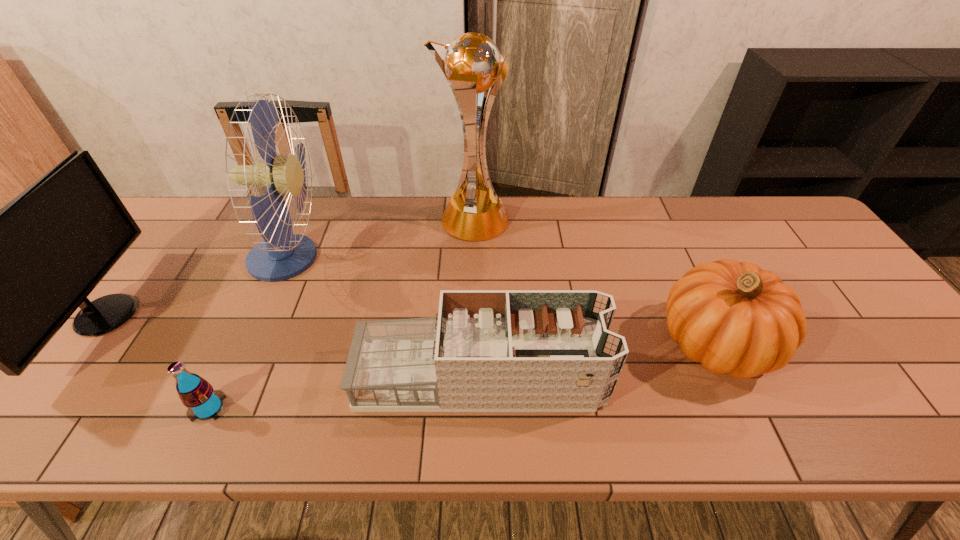
Locate which object is the third closest to the leftmost object. Please provide its 2D coordinates. Your answer should be formatted as a tuple, i.e. [(x, y)], where the tuple contains the x and y coordinates of a point satisfying the conditions above.

[(486, 350)]

Locate an element on the screen. The width and height of the screenshot is (960, 540). free space that satisfies the following two spatial constraints: 1. on the front-facing side of the leftmost object; 2. on the right side of the pumpkin is located at coordinates (85, 343).

Identify the location of blank area in the image that satisfies the following two spatial constraints: 1. at the front of the second tallest object where the blades are visible; 2. on the back side of the fourth tallest object. This screenshot has width=960, height=540. (250, 343).

Locate an element on the screen. vacant area that satisfies the following two spatial constraints: 1. on the front-facing side of the shortest object; 2. on the left side of the third tallest object is located at coordinates (35, 408).

Where is `vacant position in the image that satisfies the following two spatial constraints: 1. on the back side of the shortest object; 2. on the front-facing side of the leftmost object`? The height and width of the screenshot is (540, 960). vacant position in the image that satisfies the following two spatial constraints: 1. on the back side of the shortest object; 2. on the front-facing side of the leftmost object is located at coordinates (253, 315).